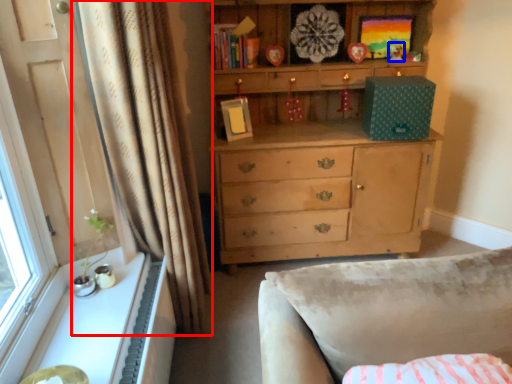
Question: Which object appears farthest to the camera in this image, curtain (highlighted by a red box) or toy (highlighted by a blue box)?

Choices:
 (A) curtain
 (B) toy

Answer: (B)